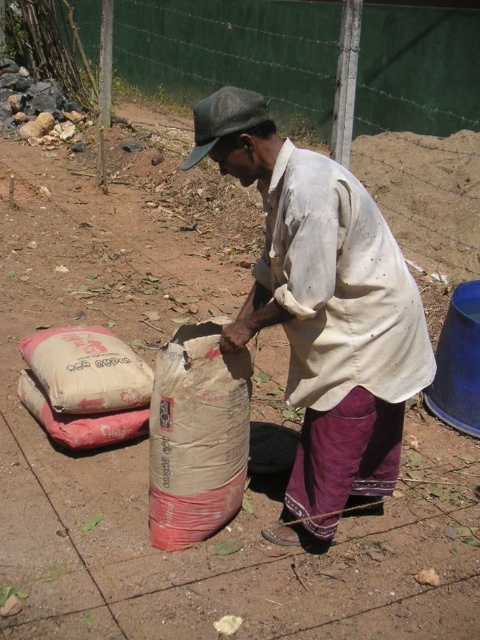
Question: Observing the image, what is the correct spatial positioning of brown paper sack at center in reference to dark gray fabric cap at upper center?

Choices:
 (A) left
 (B) right

Answer: (B)

Question: Which point appears farthest from the camera in this image?

Choices:
 (A) (305, 396)
 (B) (228, 129)
 (C) (235, 435)

Answer: (C)

Question: Which object is closer to the camera taking this photo?

Choices:
 (A) brown paper sack at center
 (B) dark gray fabric cap at upper center

Answer: (B)

Question: Among these objects, which one is nearest to the camera?

Choices:
 (A) dark gray fabric cap at upper center
 (B) brown paper sack at center

Answer: (A)

Question: Is the position of beige fabric shirt at center less distant than that of brown paper sack at center?

Choices:
 (A) yes
 (B) no

Answer: (A)

Question: Does beige fabric shirt at center have a lesser width compared to white paper sack at lower left?

Choices:
 (A) no
 (B) yes

Answer: (A)